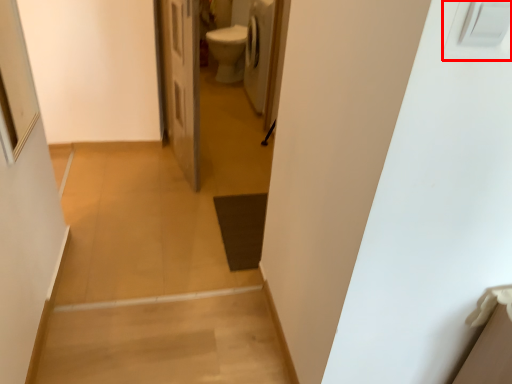
Question: From the image's perspective, what is the correct spatial relationship of electric outlet (annotated by the red box) in relation to door?

Choices:
 (A) above
 (B) below

Answer: (B)